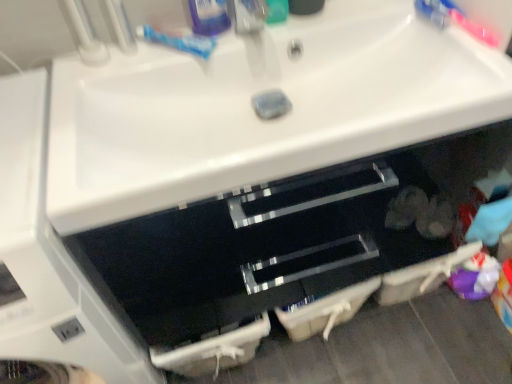
I want to click on free region on the left part of blue matte toothpaste at upper center, so click(106, 72).